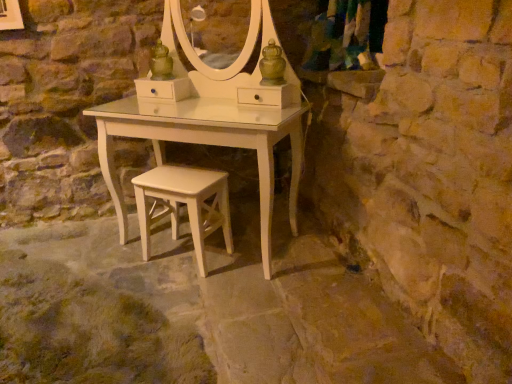
Measure the distance between point (x=156, y=174) and camera.

A distance of 2.09 meters exists between point (x=156, y=174) and camera.

Where is `light beige wood stool at center`? light beige wood stool at center is located at coordinates (185, 203).

This screenshot has width=512, height=384. What do you see at coordinates (185, 203) in the screenshot?
I see `light beige wood stool at center` at bounding box center [185, 203].

At what (x,y) coordinates should I click in order to perform the action: click on light beige wood stool at center. Please return your answer as a coordinate pair (x, y). The image size is (512, 384). Looking at the image, I should click on (185, 203).